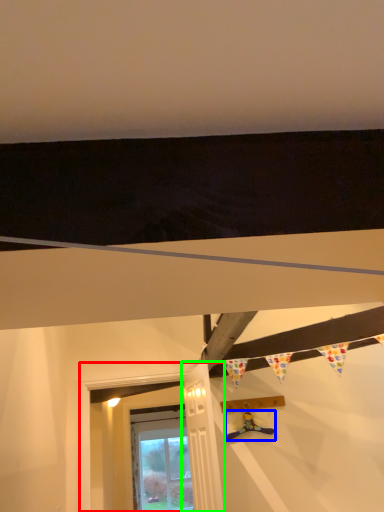
Question: Estimate the real-world distances between objects in this image. Which object is farther from window frame (highlighted by a red box), toy (highlighted by a blue box) or door (highlighted by a green box)?

Choices:
 (A) toy
 (B) door

Answer: (B)